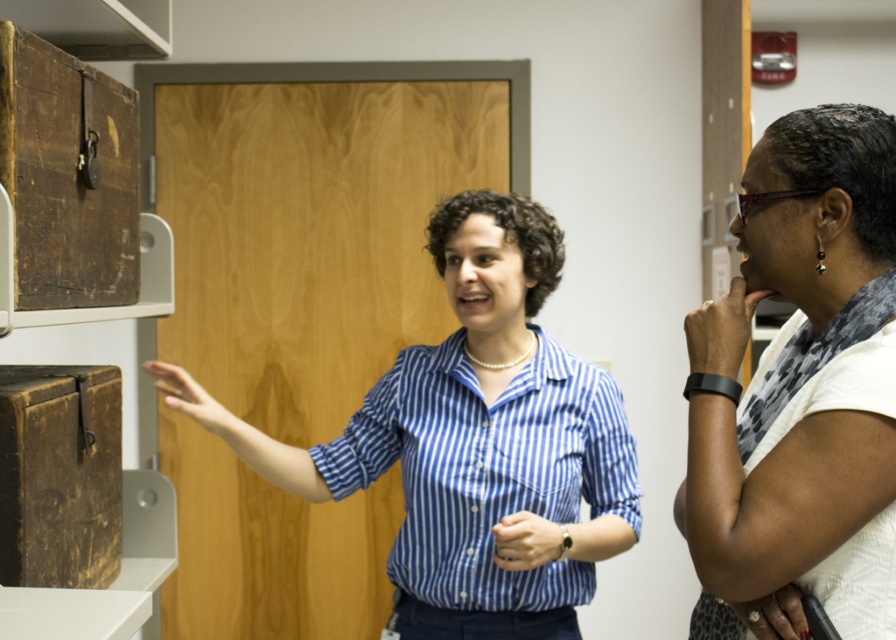
Is white textured shirt at right closer to camera compared to rustic wood drawer at upper left?

Yes, it is in front of rustic wood drawer at upper left.

Can you confirm if white textured shirt at right is shorter than rustic wood drawer at upper left?

No, white textured shirt at right is not shorter than rustic wood drawer at upper left.

Identify the location of white textured shirt at right. (800, 387).

The height and width of the screenshot is (640, 896). Find the location of `white textured shirt at right`. white textured shirt at right is located at coordinates (800, 387).

Can you confirm if blue striped shirt at center is positioned below rustic wood drawer at upper left?

Correct, blue striped shirt at center is located below rustic wood drawer at upper left.

Which is behind, point (479, 374) or point (123, 228)?

Point (479, 374)

Locate an element on the screen. The image size is (896, 640). blue striped shirt at center is located at coordinates (474, 442).

Between blue striped shirt at center and white textured shirt at right, which one appears on the right side from the viewer's perspective?

From the viewer's perspective, white textured shirt at right appears more on the right side.

Between point (184, 380) and point (894, 320), which one is positioned in front?

Point (894, 320) is in front.

Find the location of a particular element. This screenshot has width=896, height=640. blue striped shirt at center is located at coordinates (474, 442).